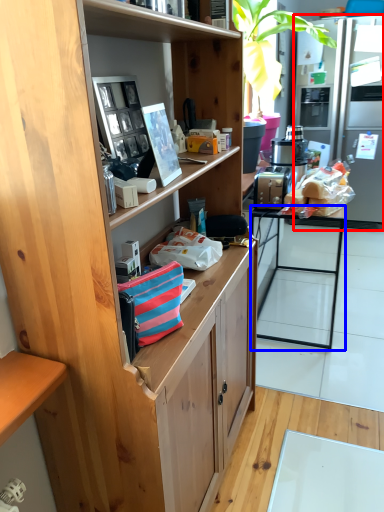
Question: Among these objects, which one is farthest to the camera, refrigerator (highlighted by a red box) or desk (highlighted by a blue box)?

Choices:
 (A) refrigerator
 (B) desk

Answer: (A)